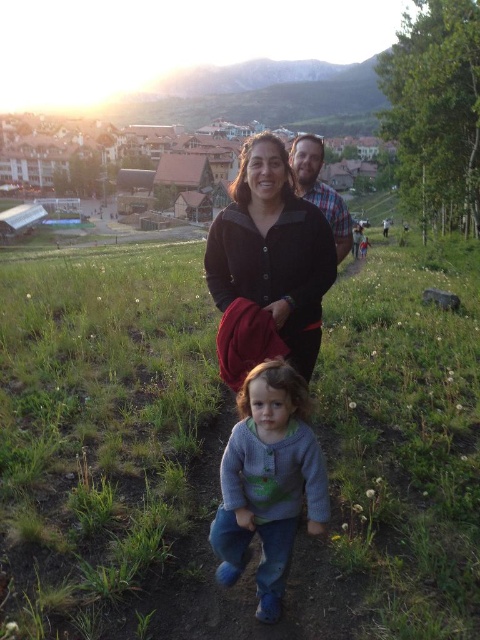
Who is lower down, black matte jacket at center or plaid shirt at center?

black matte jacket at center is lower down.

Is black matte jacket at center thinner than plaid shirt at center?

No, black matte jacket at center is not thinner than plaid shirt at center.

Which is in front, point (276, 196) or point (321, 180)?

Positioned in front is point (276, 196).

I want to click on black matte jacket at center, so click(273, 250).

Is knitted sweater at center to the right of black matte jacket at center from the viewer's perspective?

Correct, you'll find knitted sweater at center to the right of black matte jacket at center.

Is point (296, 476) less distant than point (316, 296)?

That is True.

In order to click on knitted sweater at center in this screenshot , I will do `click(268, 481)`.

Can you confirm if green grassy at center is smaller than black matte jacket at center?

No, green grassy at center is not smaller than black matte jacket at center.

Find the location of `green grassy at center`. green grassy at center is located at coordinates (103, 435).

This screenshot has height=640, width=480. Identify the location of green grassy at center. (103, 435).